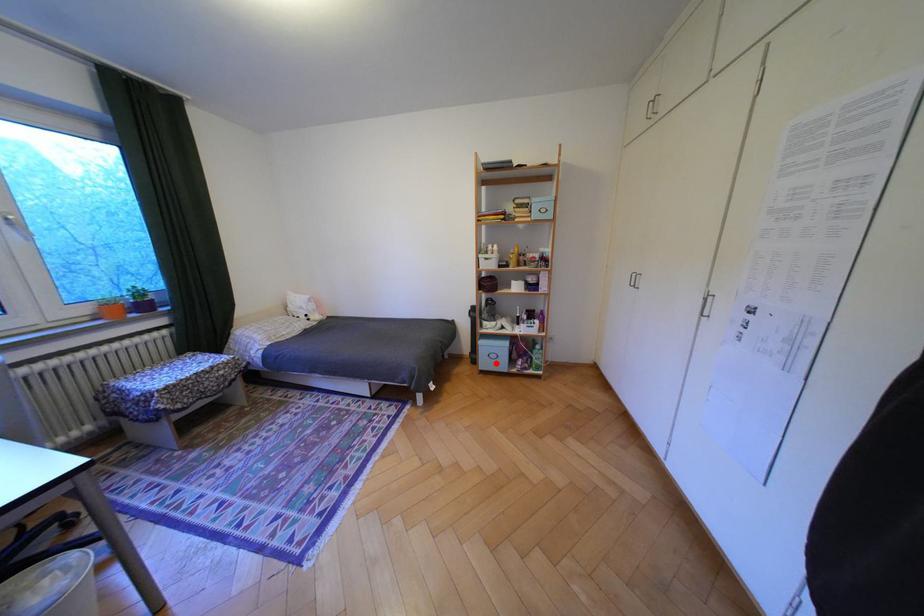
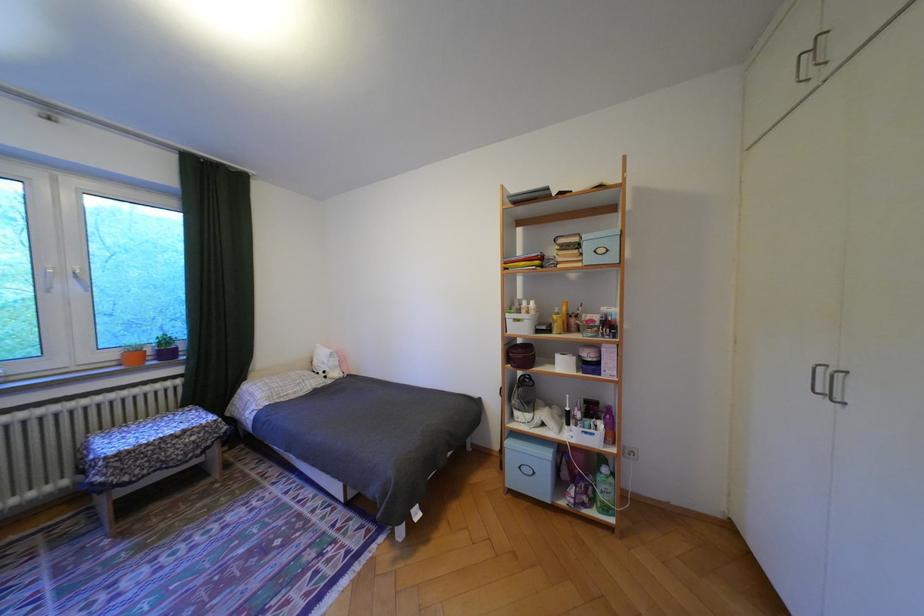
Find the pixel in the second image that matches the highlighted location in the first image.

(525, 479)